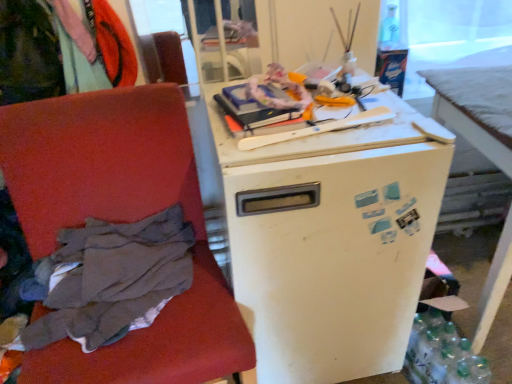
Question: From a real-world perspective, is velvet-like fabric at upper left, which is the first clothing in left-to-right order, above or below white matte desk at right?

Choices:
 (A) above
 (B) below

Answer: (A)

Question: Considering their positions, is velvet-like fabric at upper left, the 1th clothing positioned from the top, located in front of or behind white matte desk at right?

Choices:
 (A) behind
 (B) front

Answer: (A)

Question: Estimate the real-world distances between objects in this image. Which object is farther from the white matte refrigerator at center?

Choices:
 (A) clear plastic bottles at lower right
 (B) dark gray fabric at left, which is the 2th clothing from top to bottom
 (C) velvet-like fabric at upper left, which is the first clothing in left-to-right order
 (D) white matte desk at right
 (E) velvet-like red chair at left

Answer: (C)

Question: Which object is the farthest from the dark gray fabric at left, the 1th clothing positioned from the right?

Choices:
 (A) velvet-like fabric at upper left, which is the first clothing in left-to-right order
 (B) white matte refrigerator at center
 (C) clear plastic bottles at lower right
 (D) white matte desk at right
 (E) velvet-like red chair at left

Answer: (D)